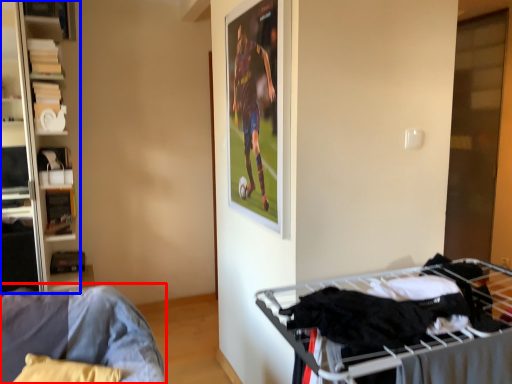
Question: Among these objects, which one is nearest to the camera, furniture (highlighted by a red box) or shelf (highlighted by a blue box)?

Choices:
 (A) furniture
 (B) shelf

Answer: (A)